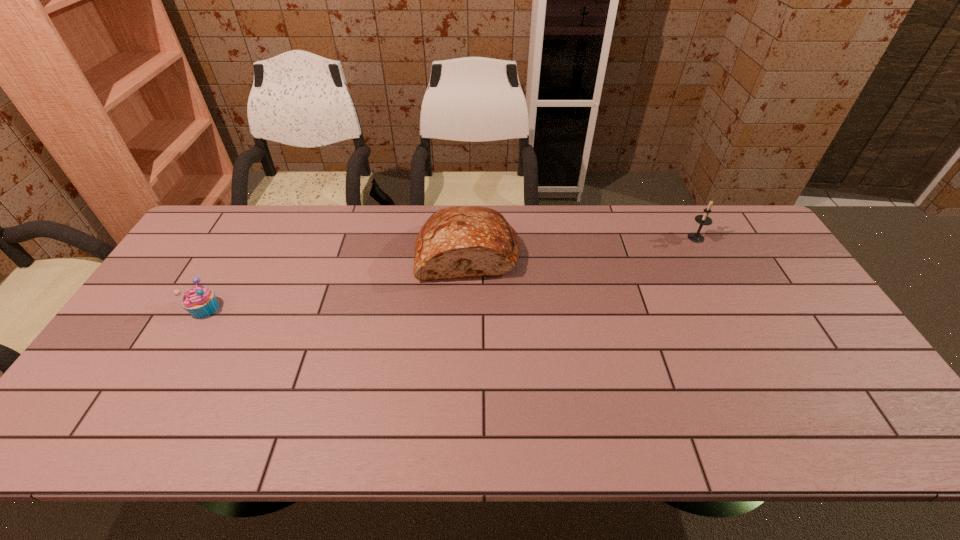
This screenshot has width=960, height=540. What are the coordinates of `object that can be found as the second closest to the nearest object` in the screenshot? It's located at (701, 219).

Identify which object is located as the nearest to the bread. Please provide its 2D coordinates. Your answer should be formatted as a tuple, i.e. [(x, y)], where the tuple contains the x and y coordinates of a point satisfying the conditions above.

[(199, 301)]

At what (x,y) coordinates should I click in order to perform the action: click on vacant space that satisfies the following two spatial constraints: 1. on the back side of the candle holder; 2. on the right side of the leftmost object. Please return your answer as a coordinate pair (x, y). Looking at the image, I should click on (246, 238).